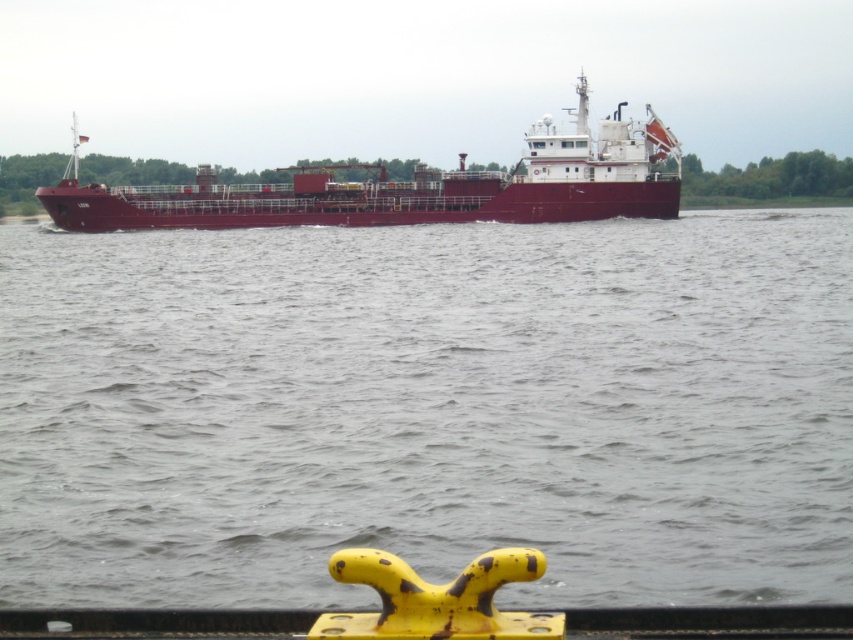
Who is shorter, gray water at center or maroon matte ship at center?

With less height is gray water at center.

In the scene shown: Between gray water at center and maroon matte ship at center, which one is positioned lower?

gray water at center is below.

Is point (9, 257) positioned behind point (585, 182)?

No, it is in front of (585, 182).

Identify the location of gray water at center. Image resolution: width=853 pixels, height=640 pixels. (428, 410).